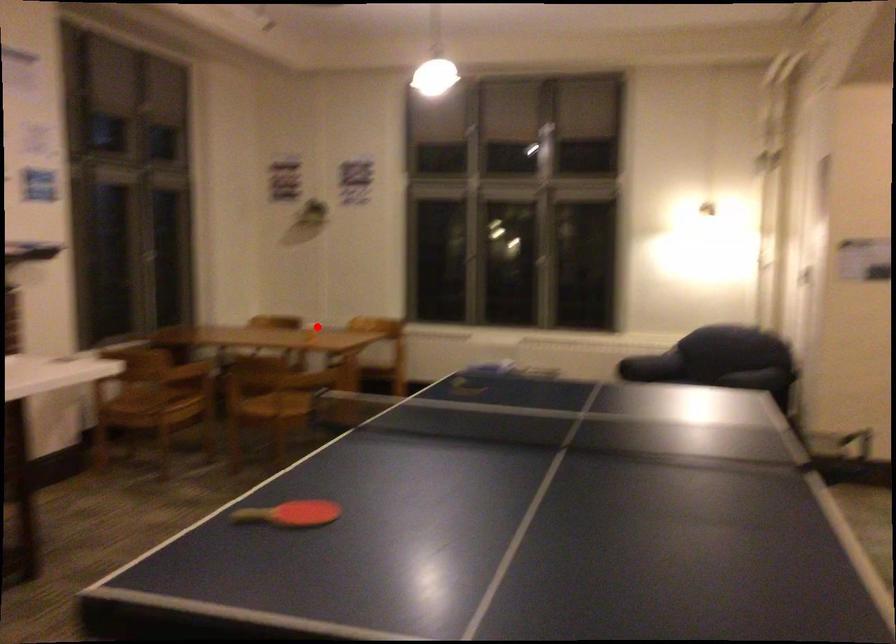
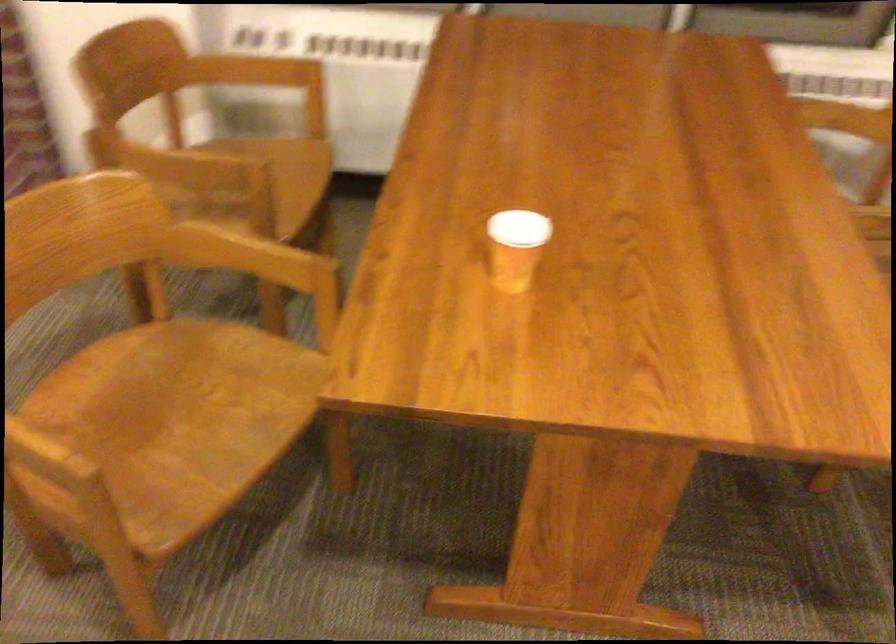
Where in the second image is the point corresponding to the highlighted location from the first image?

(515, 247)